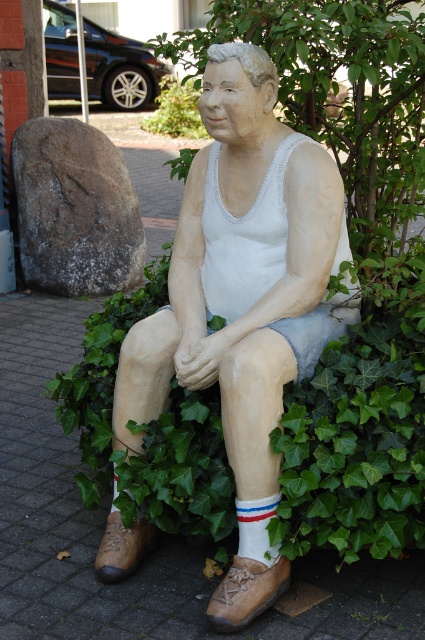
Can you confirm if matte white statue at center is positioned to the left of green leafy plant at upper center?

In fact, matte white statue at center is to the right of green leafy plant at upper center.

Can you confirm if matte white statue at center is bigger than green leafy plant at upper center?

Actually, matte white statue at center might be smaller than green leafy plant at upper center.

This screenshot has width=425, height=640. In order to click on matte white statue at center in this screenshot , I will do `click(243, 272)`.

Is matte white statue at center thinner than white cotton sock at lower center?

In fact, matte white statue at center might be wider than white cotton sock at lower center.

Does matte white statue at center have a greater width compared to white cotton sock at lower center?

Yes, matte white statue at center is wider than white cotton sock at lower center.

Is point (229, 369) closer to viewer compared to point (238, 518)?

Yes, it is in front of point (238, 518).

What are the coordinates of `matte white statue at center` in the screenshot? It's located at (243, 272).

How far apart are green leafy plant at upper center and white cotton sock at lower center?

9.71 meters

Between green leafy plant at upper center and white cotton sock at lower center, which one has more height?

Standing taller between the two is green leafy plant at upper center.

Image resolution: width=425 pixels, height=640 pixels. Find the location of `green leafy plant at upper center`. green leafy plant at upper center is located at coordinates (175, 109).

Image resolution: width=425 pixels, height=640 pixels. I want to click on green leafy plant at upper center, so click(175, 109).